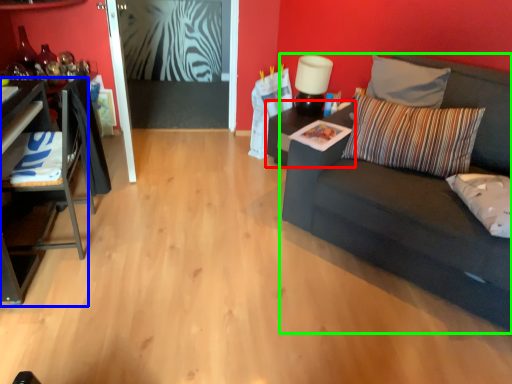
Question: Estimate the real-world distances between objects in this image. Which object is closer to table (highlighted by a red box), table (highlighted by a blue box) or studio couch (highlighted by a green box)?

Choices:
 (A) table
 (B) studio couch

Answer: (B)